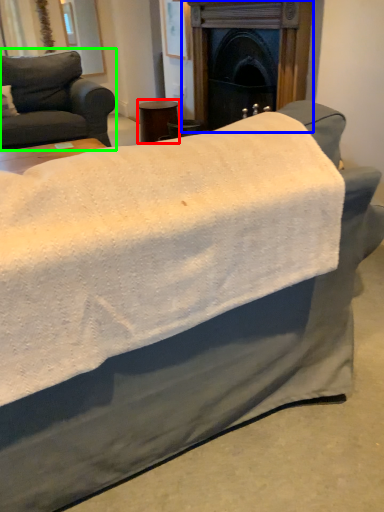
Question: Based on their relative distances, which object is farther from side table (highlighted by a red box)? Choose from fireplace (highlighted by a blue box) and studio couch (highlighted by a green box).

Choices:
 (A) fireplace
 (B) studio couch

Answer: (A)